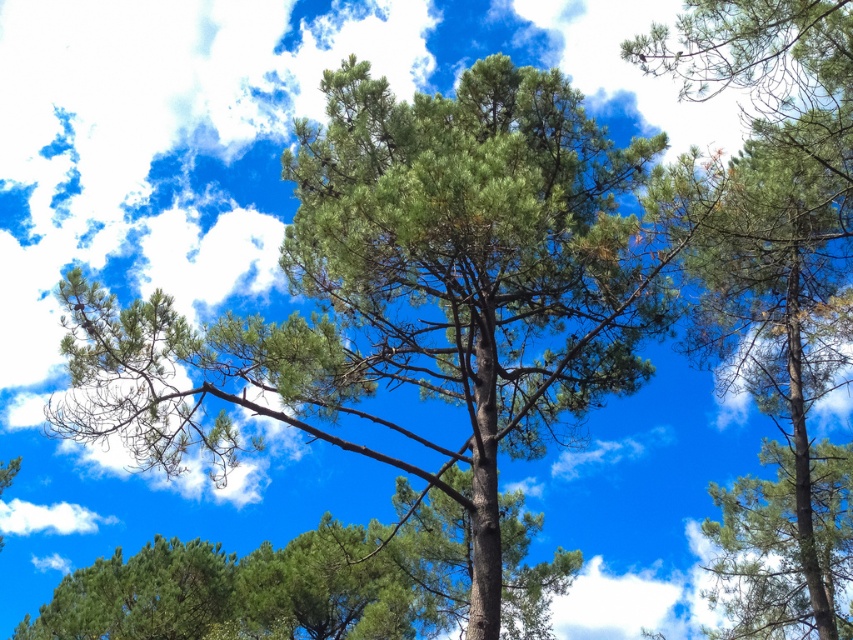
You are standing in a forest and want to take a photo of the point at coordinates point (517, 580). If your camera has a maximum focus range of 20 meters, will you be able to focus on that point?

The distance of point (517, 580) from camera is 23.11 meters, which exceeds the camera maximum focus range of 20 meters. Therefore, you won cannot focus on that point.